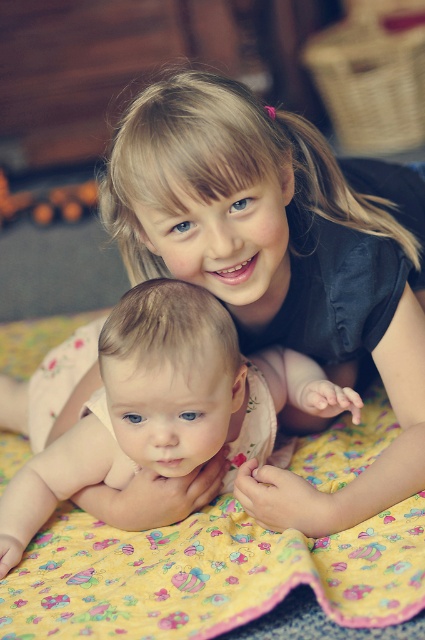
Question: Does yellow floral fabric at center have a larger size compared to smooth beige baby at center?

Choices:
 (A) no
 (B) yes

Answer: (B)

Question: Which object appears closest to the camera in this image?

Choices:
 (A) smooth beige baby at center
 (B) yellow floral fabric at center

Answer: (B)

Question: Can you confirm if yellow floral fabric at center is smaller than smooth beige baby at center?

Choices:
 (A) no
 (B) yes

Answer: (A)

Question: Does yellow floral fabric at center have a greater width compared to smooth beige baby at center?

Choices:
 (A) yes
 (B) no

Answer: (A)